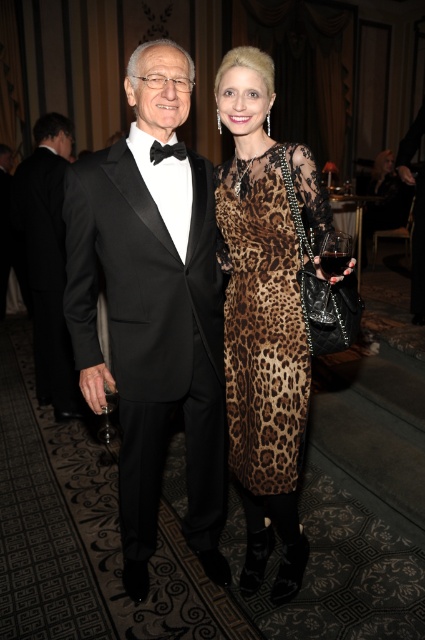
Question: Is black satin tuxedo at left thinner than black satin bow tie at center?

Choices:
 (A) yes
 (B) no

Answer: (B)

Question: Among these objects, which one is farthest from the camera?

Choices:
 (A) black satin tuxedo at left
 (B) black satin bow tie at center

Answer: (A)

Question: Which point is farther from the camera taking this photo?

Choices:
 (A) (272, 481)
 (B) (107, 387)

Answer: (B)

Question: Which point is closer to the camera taking this photo?

Choices:
 (A) (155, 152)
 (B) (124, 481)

Answer: (A)

Question: Can you confirm if black satin tuxedo at left is wider than black satin bow tie at center?

Choices:
 (A) yes
 (B) no

Answer: (A)

Question: Is transparent plastic wine glass at center positioned behind black satin bow tie at center?

Choices:
 (A) no
 (B) yes

Answer: (A)